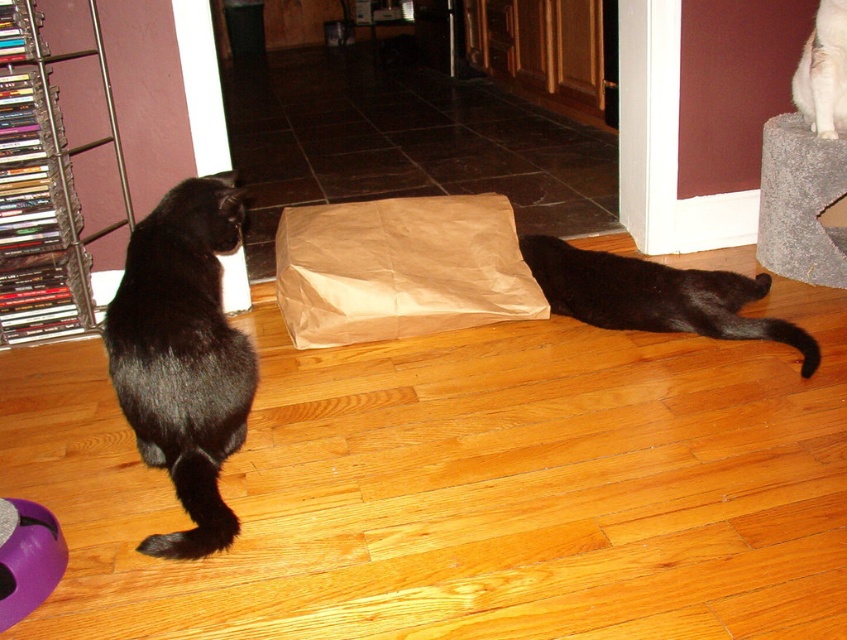
Measure the distance between brown paper bag at center and camera.

brown paper bag at center is 7.16 feet away from camera.

Identify the location of brown paper bag at center. point(400,268).

What do you see at coordinates (400, 268) in the screenshot? The width and height of the screenshot is (847, 640). I see `brown paper bag at center` at bounding box center [400, 268].

Locate an element on the screen. The height and width of the screenshot is (640, 847). brown paper bag at center is located at coordinates (400, 268).

Can you confirm if black fur cat at left is taller than brown paper bag at center?

Yes.

What do you see at coordinates (183, 355) in the screenshot? The height and width of the screenshot is (640, 847). I see `black fur cat at left` at bounding box center [183, 355].

Find the location of `black fur cat at left`. black fur cat at left is located at coordinates (183, 355).

Consider the image. Does black fur cat at left appear on the right side of black matte fur cat at lower right?

No, black fur cat at left is not to the right of black matte fur cat at lower right.

Does point (248, 349) come farther from viewer compared to point (580, 317)?

No, (248, 349) is in front of (580, 317).

The height and width of the screenshot is (640, 847). Find the location of `black fur cat at left`. black fur cat at left is located at coordinates (183, 355).